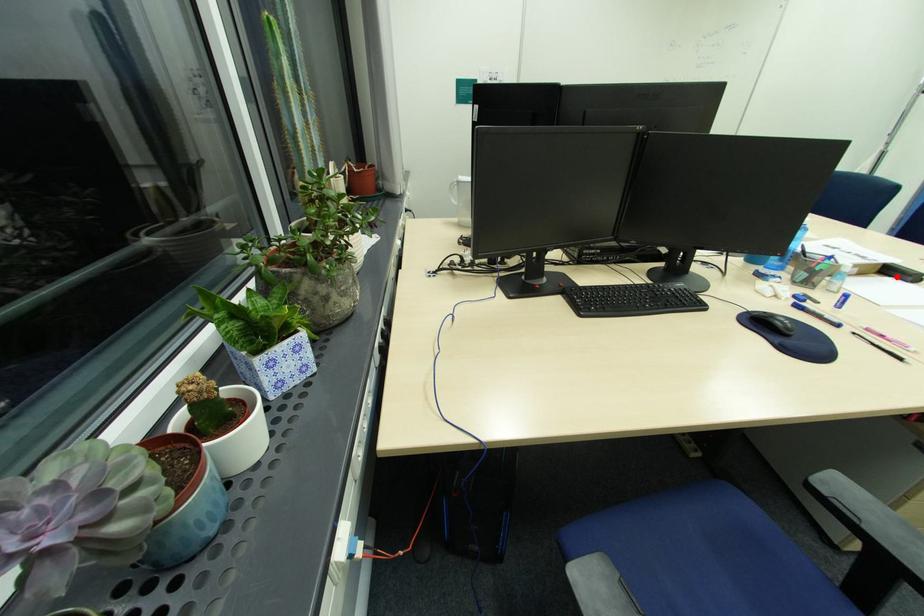
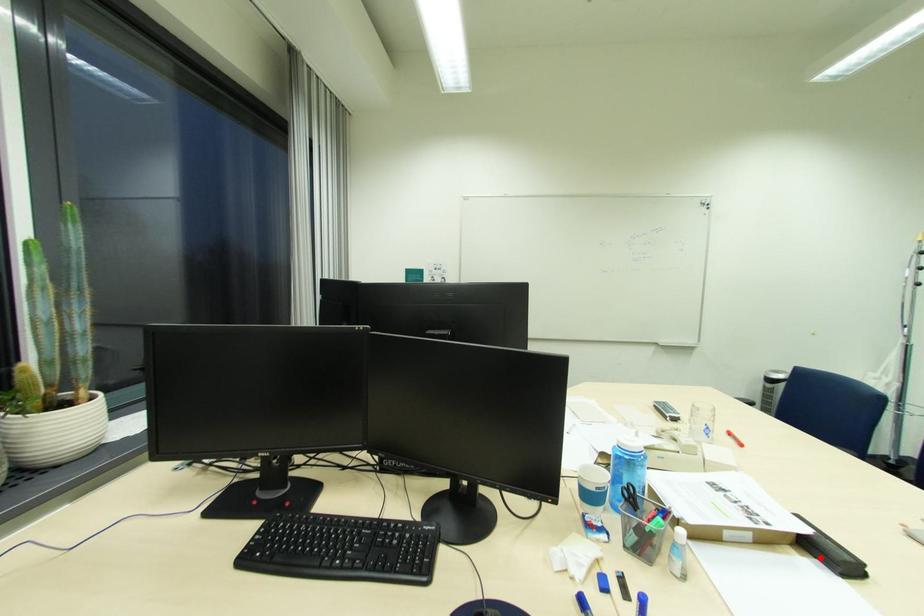
I am providing you with two images of the same scene from different viewpoints. A red point is marked on the first image and another point is marked on the second image. Is the marked point in image1 the same physical position as the marked point in image2?

Yes